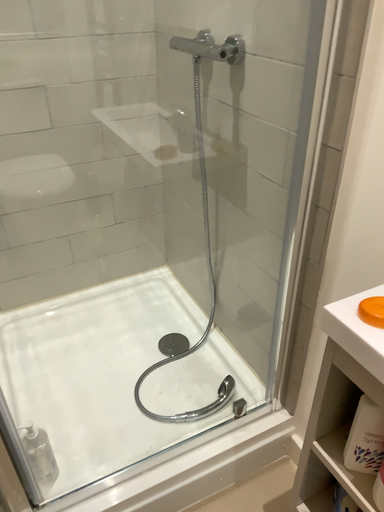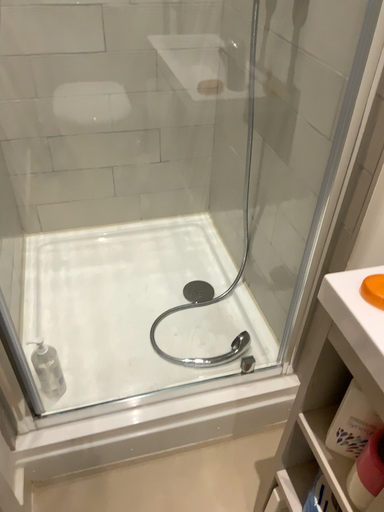
Question: How did the camera likely rotate when shooting the video?

Choices:
 (A) rotated right
 (B) rotated left

Answer: (B)